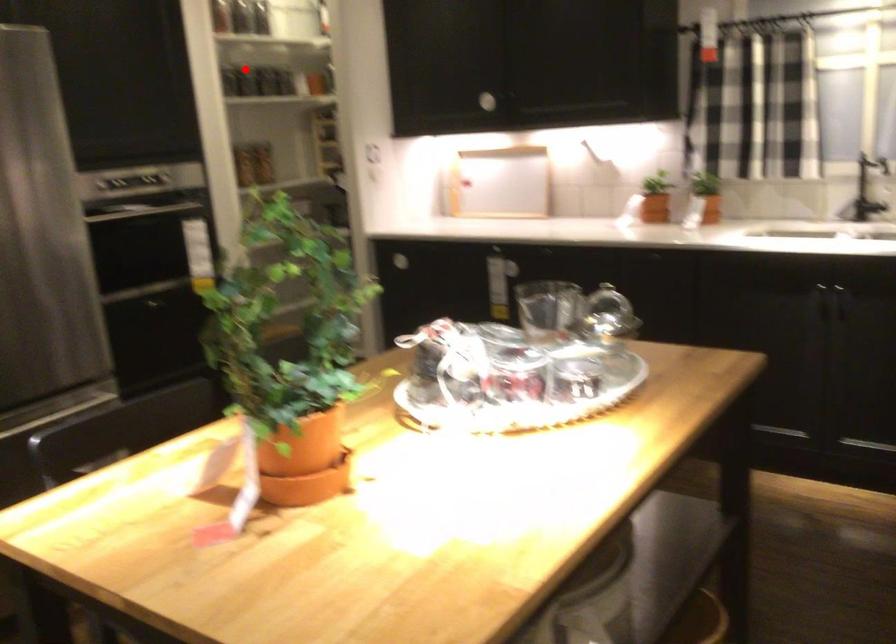
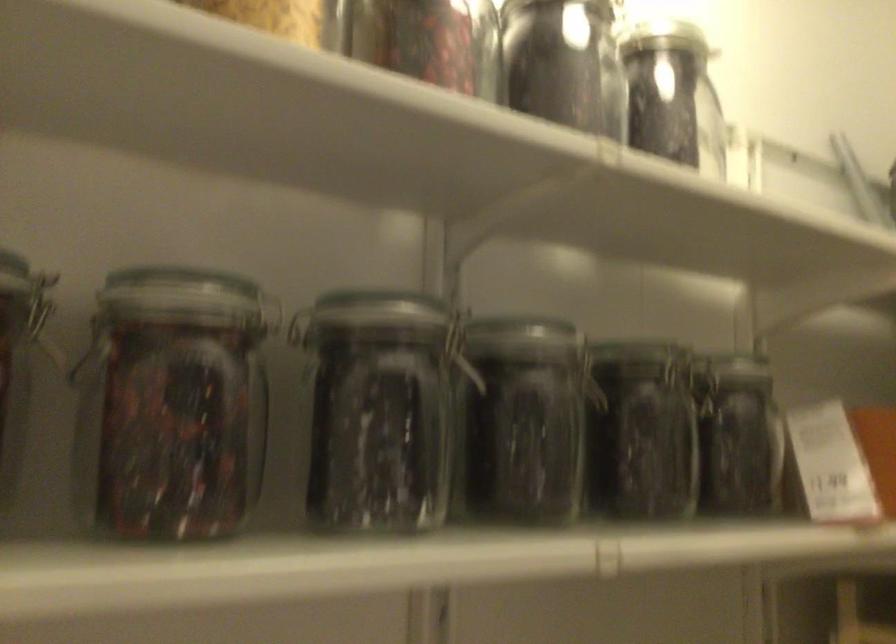
Question: I am providing you with two images of the same scene from different viewpoints. Image1 has a red point marked. In image2, the corresponding 3D location appears at what relative position? Reply with the corresponding letter.

Choices:
 (A) Closer
 (B) Farther

Answer: (A)